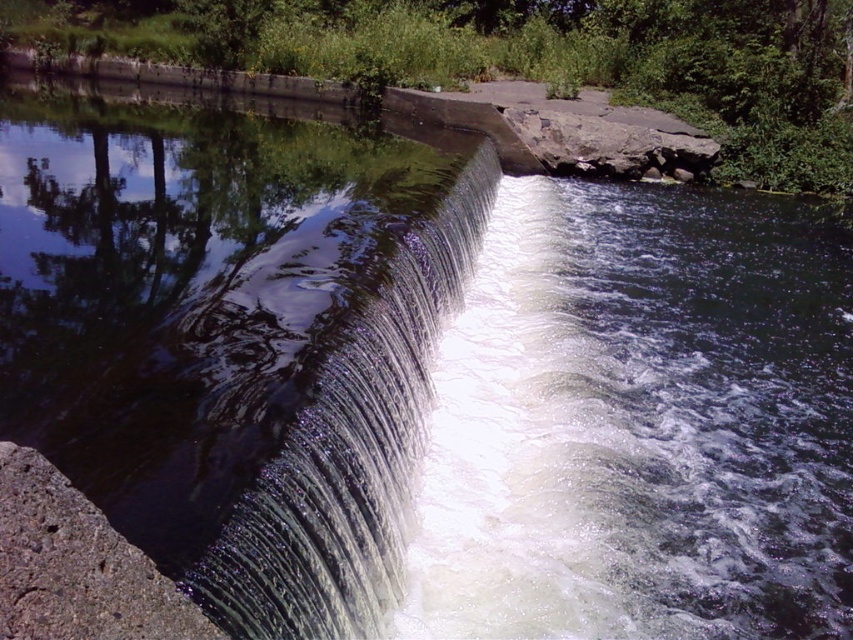
Question: Estimate the real-world distances between objects in this image. Which object is closer to the green leafy tree at upper left?

Choices:
 (A) gray rough concrete at lower left
 (B) clear glass waterfall at center

Answer: (B)

Question: Is green leafy tree at upper left above gray rough concrete at lower left?

Choices:
 (A) no
 (B) yes

Answer: (B)

Question: Estimate the real-world distances between objects in this image. Which object is farther from the gray rough concrete at lower left?

Choices:
 (A) green leafy tree at upper left
 (B) clear glass waterfall at center

Answer: (A)

Question: Does clear glass waterfall at center come behind gray rough concrete at lower left?

Choices:
 (A) yes
 (B) no

Answer: (A)

Question: Can you confirm if green leafy tree at upper left is positioned to the left of gray rough concrete at lower left?

Choices:
 (A) yes
 (B) no

Answer: (B)

Question: Which of the following is the farthest from the observer?

Choices:
 (A) green leafy tree at upper left
 (B) clear glass waterfall at center

Answer: (A)